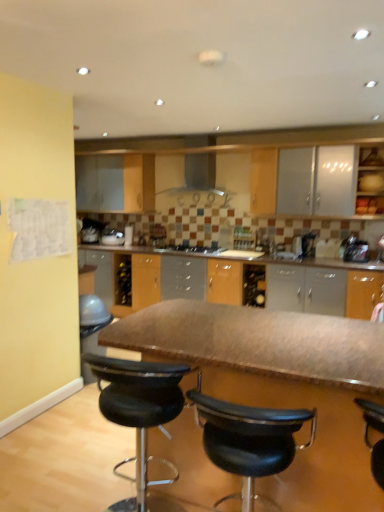
Identify the location of vacant space situated above smooth brown table at center (from a real-world perspective). (257, 334).